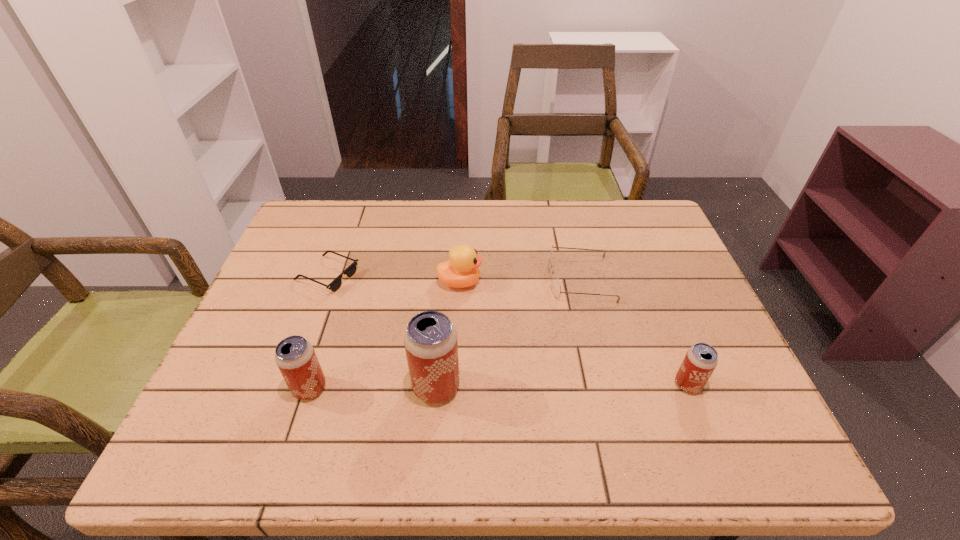
I want to click on vacant space that satisfies the following two spatial constraints: 1. on the lenses of the sunglasses; 2. on the right side of the shortest beer can, so [287, 384].

Locate an element on the screen. free region that satisfies the following two spatial constraints: 1. on the lenses of the tallest beer can; 2. on the left side of the sunglasses is located at coordinates (286, 387).

You are a GUI agent. You are given a task and a screenshot of the screen. Output one action in this format:
    pyautogui.click(x=<x>, y=<y>)
    Task: Click on the vacant position in the image that satisfies the following two spatial constraints: 1. on the back side of the rightmost beer can; 2. on the left side of the tallest object
    
    Given the screenshot: What is the action you would take?
    pyautogui.click(x=437, y=384)

Where is `vacant point that satisfies the following two spatial constraints: 1. on the lenses of the sunglasses; 2. on the back side of the second tallest object`? vacant point that satisfies the following two spatial constraints: 1. on the lenses of the sunglasses; 2. on the back side of the second tallest object is located at coordinates (286, 388).

I want to click on vacant area that satisfies the following two spatial constraints: 1. on the face of the duckling; 2. on the left side of the rightmost object, so click(x=455, y=384).

The height and width of the screenshot is (540, 960). In order to click on vacant space that satisfies the following two spatial constraints: 1. on the lenses of the shortest object; 2. on the back side of the rightmost beer can in this screenshot , I will do (x=287, y=384).